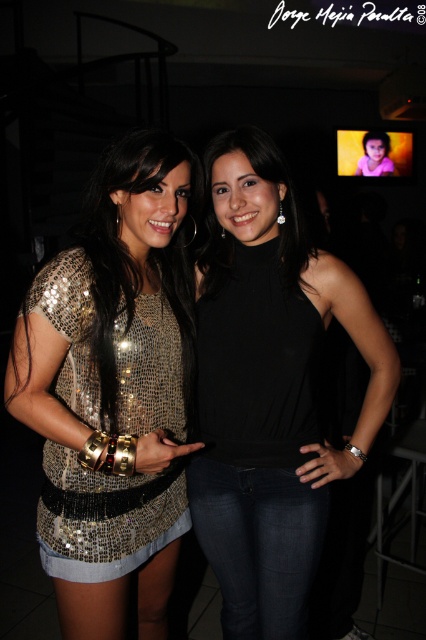
You are taking a photo of two women at a party. You notice two points in the image at coordinates point (149, 408) and point (189, 403). Which point is closer to the camera?

Point (149, 408) is closer to the camera than point (189, 403).

You are a photographer adjusting your camera settings to focus on the two women in the image. Since you want to ensure both the black matte tank top at center and the sequined gold dress at center are in focus, which one should you focus on first to achieve proper depth of field?

You should focus on the black matte tank top at center first because it is closer to the viewer than the sequined gold dress at center, ensuring proper depth of field for both.